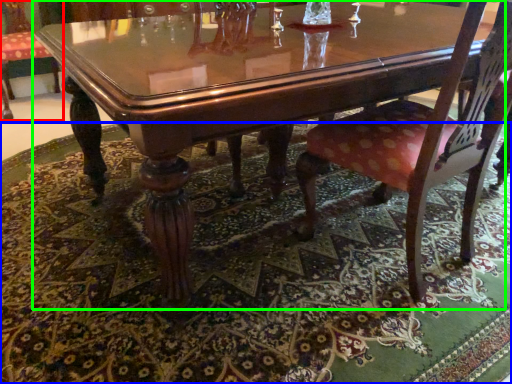
Question: Which object is positioned closest to chair (highlighted by a red box)? Select from place mat (highlighted by a blue box) and coffee table (highlighted by a green box).

Choices:
 (A) place mat
 (B) coffee table

Answer: (A)